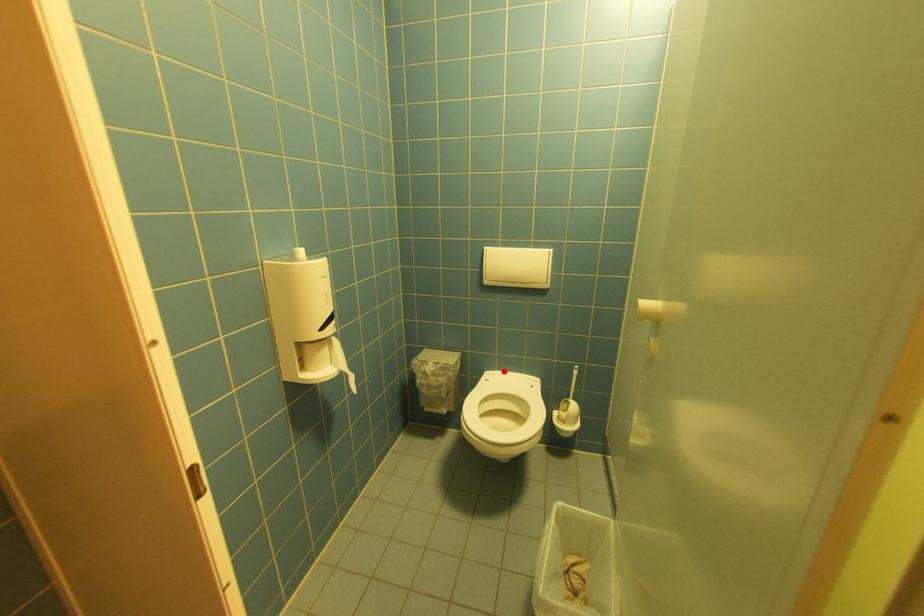
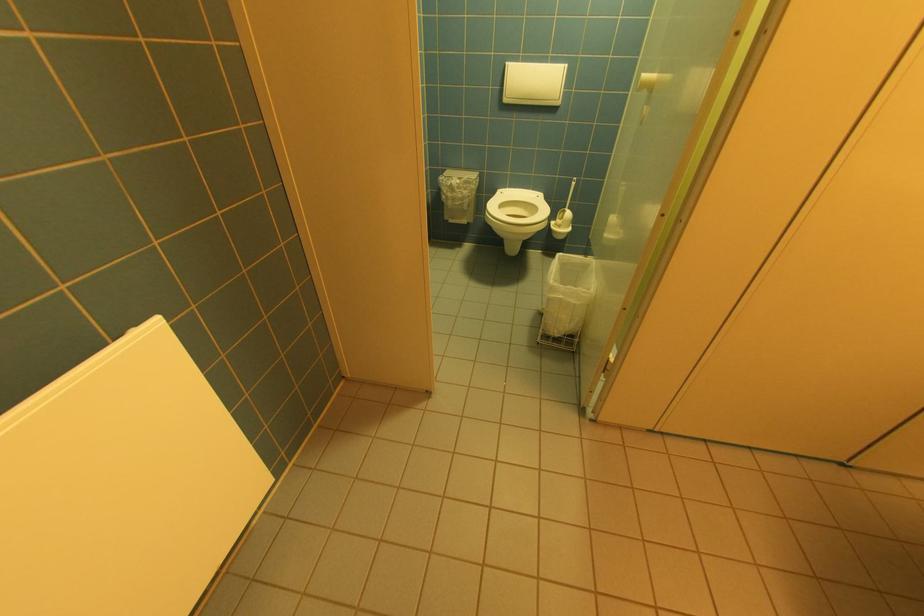
Question: I am providing you with two images of the same scene from different viewpoints. In image1, a red point is highlighted. Considering the same 3D point in image2, which of the following is correct?

Choices:
 (A) It is closer
 (B) It is farther

Answer: (A)